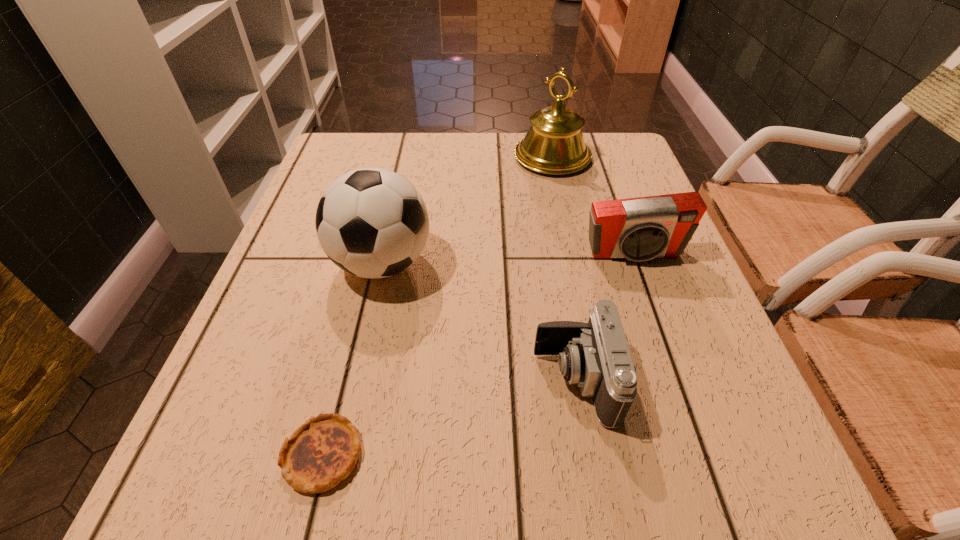
Identify the location of vacant space that satisfies the following two spatial constraints: 1. on the front-facing side of the taller camera; 2. at the front of the left camera with an open lens cover. Image resolution: width=960 pixels, height=540 pixels. (678, 380).

You are a GUI agent. You are given a task and a screenshot of the screen. Output one action in this format:
    pyautogui.click(x=<x>, y=<y>)
    Task: Click on the vacant space that satisfies the following two spatial constraints: 1. on the front-facing side of the taller camera; 2. at the front of the fourth tallest object with an open lens cover
    
    Given the screenshot: What is the action you would take?
    pyautogui.click(x=678, y=380)

This screenshot has width=960, height=540. Identify the location of free space that satisfies the following two spatial constraints: 1. on the back side of the quiche; 2. on the left side of the bell. (396, 157).